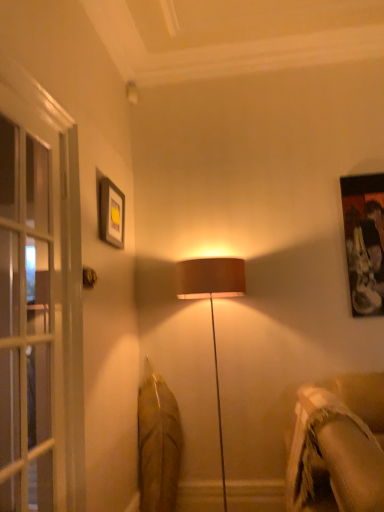
Question: Does clear glass screen door at left come behind beige textured fabric couch at lower right?

Choices:
 (A) no
 (B) yes

Answer: (A)

Question: Is clear glass screen door at left located outside beige textured fabric couch at lower right?

Choices:
 (A) yes
 (B) no

Answer: (A)

Question: From the image's perspective, is clear glass screen door at left located above beige textured fabric couch at lower right?

Choices:
 (A) no
 (B) yes

Answer: (B)

Question: Is clear glass screen door at left looking in the opposite direction of beige textured fabric couch at lower right?

Choices:
 (A) no
 (B) yes

Answer: (A)

Question: From the image's perspective, would you say clear glass screen door at left is shown under beige textured fabric couch at lower right?

Choices:
 (A) yes
 (B) no

Answer: (B)

Question: Considering the relative positions of clear glass screen door at left and beige textured fabric couch at lower right in the image provided, is clear glass screen door at left to the left of beige textured fabric couch at lower right from the viewer's perspective?

Choices:
 (A) yes
 (B) no

Answer: (A)

Question: Can you confirm if clear glass screen door at left is positioned to the right of metallic gold door handle at upper left?

Choices:
 (A) no
 (B) yes

Answer: (A)

Question: Could metallic gold door handle at upper left be considered to be inside clear glass screen door at left?

Choices:
 (A) no
 (B) yes

Answer: (A)

Question: Is clear glass screen door at left next to metallic gold door handle at upper left and touching it?

Choices:
 (A) no
 (B) yes

Answer: (A)

Question: Is clear glass screen door at left not within metallic gold door handle at upper left?

Choices:
 (A) yes
 (B) no

Answer: (A)

Question: Is clear glass screen door at left positioned before metallic gold door handle at upper left?

Choices:
 (A) no
 (B) yes

Answer: (B)

Question: Does clear glass screen door at left have a larger size compared to metallic gold door handle at upper left?

Choices:
 (A) yes
 (B) no

Answer: (A)

Question: Is metallic gold door handle at upper left wider than matte black picture frame at upper left?

Choices:
 (A) no
 (B) yes

Answer: (A)